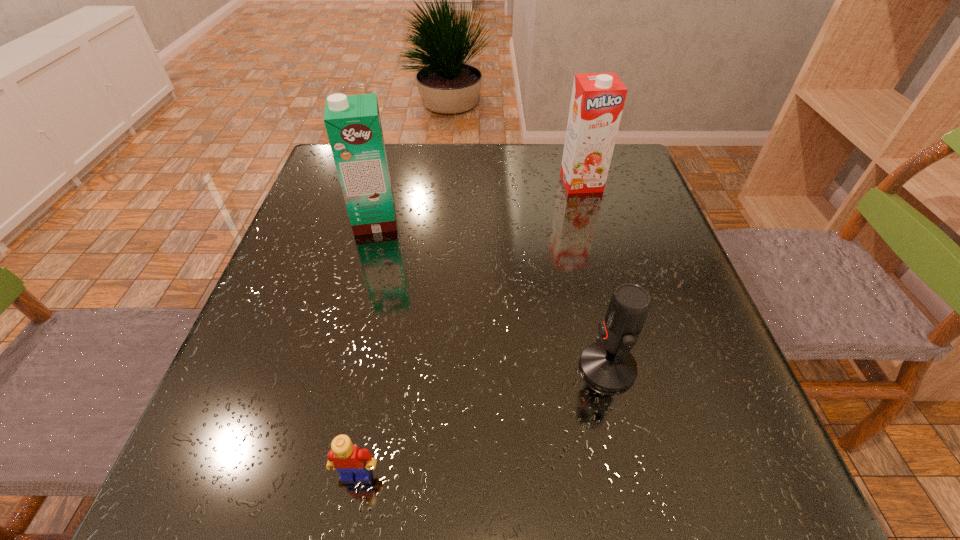
The width and height of the screenshot is (960, 540). What are the coordinates of `vacant space that satisfies the following two spatial constraints: 1. on the front side of the farther carton; 2. on the side of the microphone with the red ring` in the screenshot? It's located at 633,367.